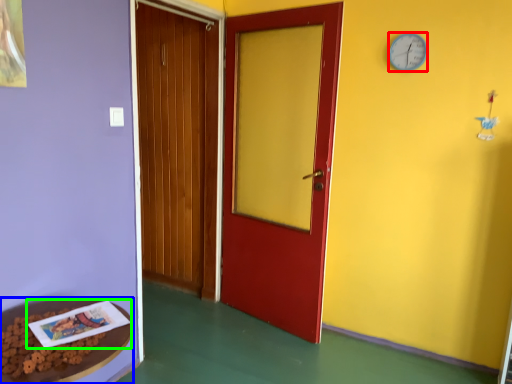
Question: Which is nearer to the clock (highlighted by a red box)? table (highlighted by a blue box) or book (highlighted by a green box).

Choices:
 (A) table
 (B) book

Answer: (B)